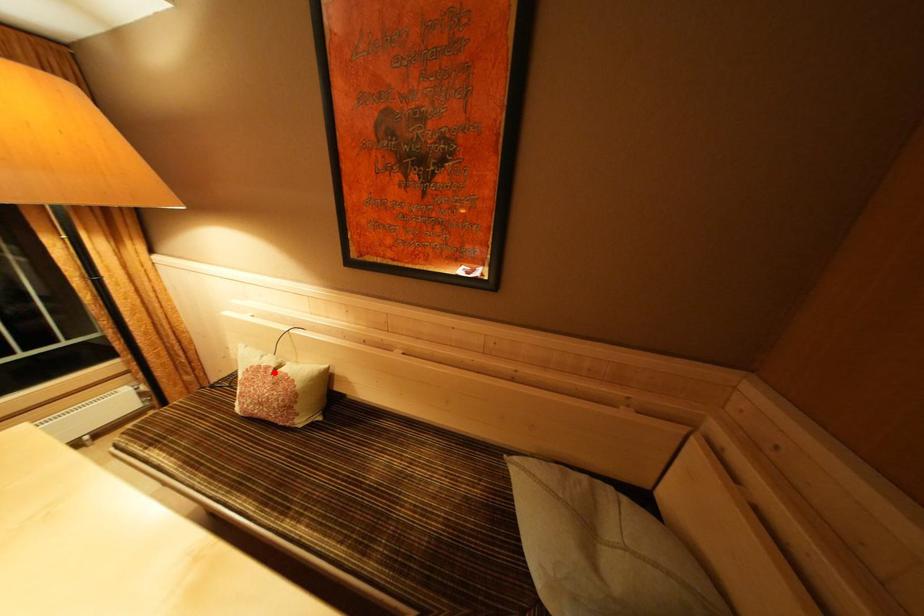
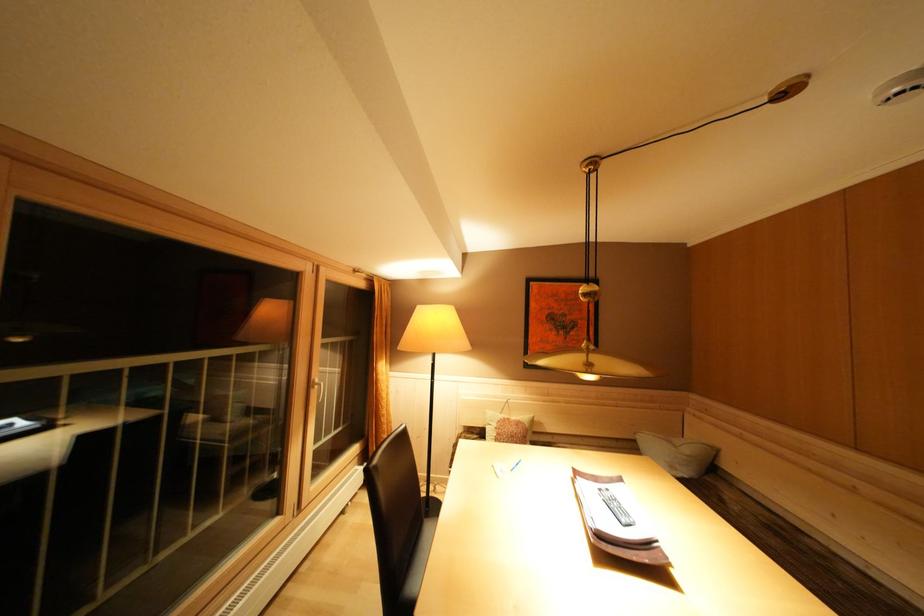
The point at the highlighted location is marked in the first image. Where is the corresponding point in the second image?

(515, 424)